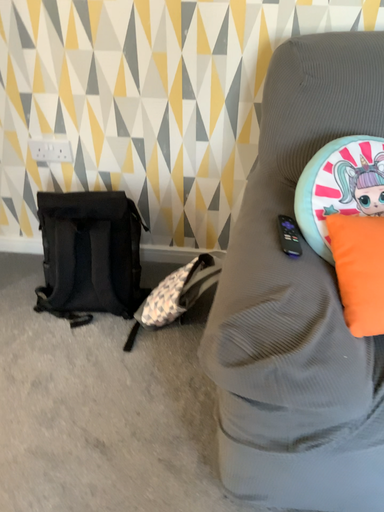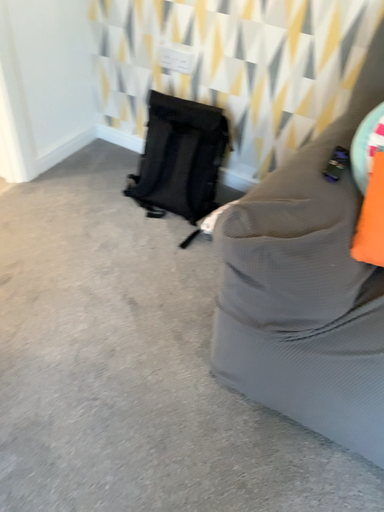
Question: How did the camera likely rotate when shooting the video?

Choices:
 (A) rotated right
 (B) rotated left

Answer: (B)